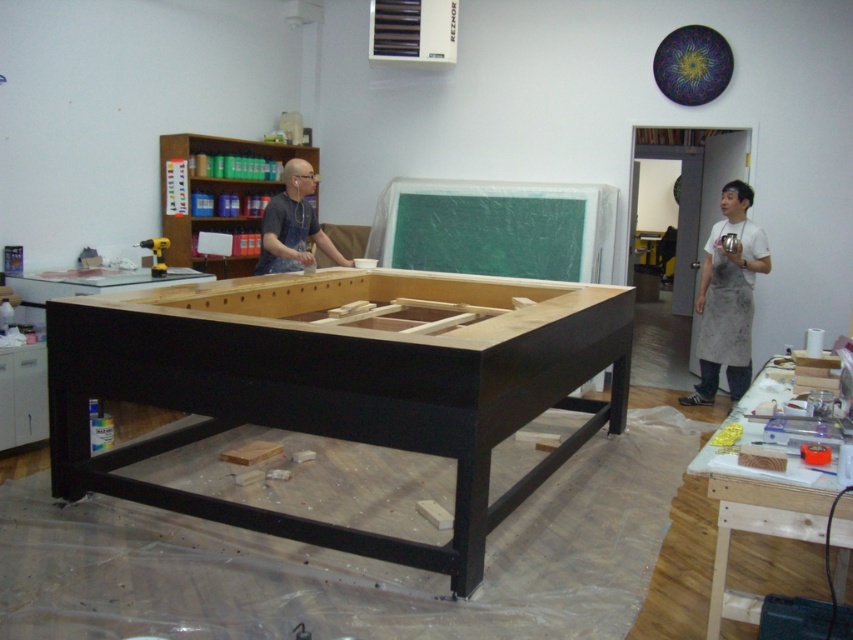
Question: Is black wood table at center positioned at the back of wooden at center?

Choices:
 (A) no
 (B) yes

Answer: (B)

Question: Is matte black shirt at upper center smaller than metallic yellow drill at left?

Choices:
 (A) yes
 (B) no

Answer: (B)

Question: Among these objects, which one is nearest to the camera?

Choices:
 (A) metallic yellow drill at left
 (B) black wood table at center

Answer: (B)

Question: Which of these objects is positioned closest to the matte black shirt at upper center?

Choices:
 (A) wooden at center
 (B) white apron at right
 (C) black wood table at center

Answer: (C)

Question: Can you confirm if black wood table at center is smaller than matte black shirt at upper center?

Choices:
 (A) no
 (B) yes

Answer: (A)

Question: Estimate the real-world distances between objects in this image. Which object is closer to the white apron at right?

Choices:
 (A) wooden at center
 (B) black wood table at center
 (C) metallic yellow drill at left

Answer: (B)